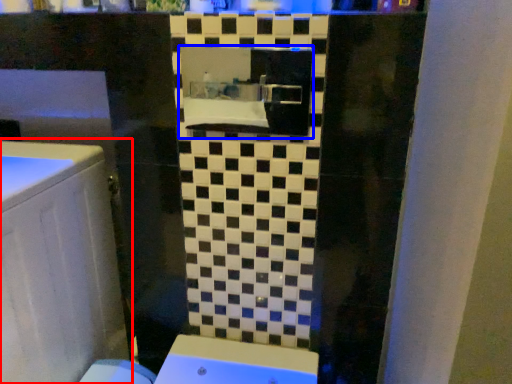
Question: Which point is closer to the camera, bathroom cabinet (highlighted by a red box) or medicine cabinet (highlighted by a blue box)?

Choices:
 (A) bathroom cabinet
 (B) medicine cabinet

Answer: (A)